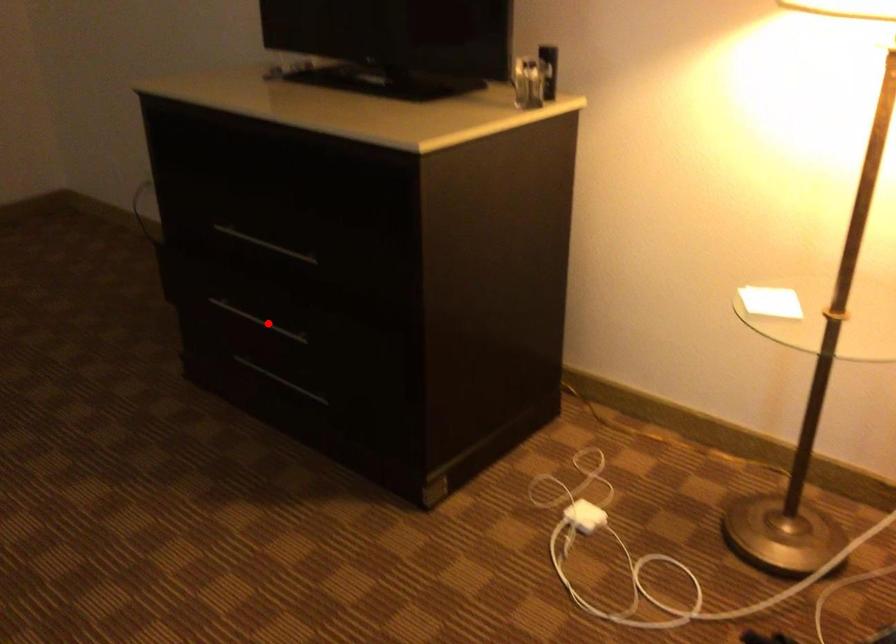
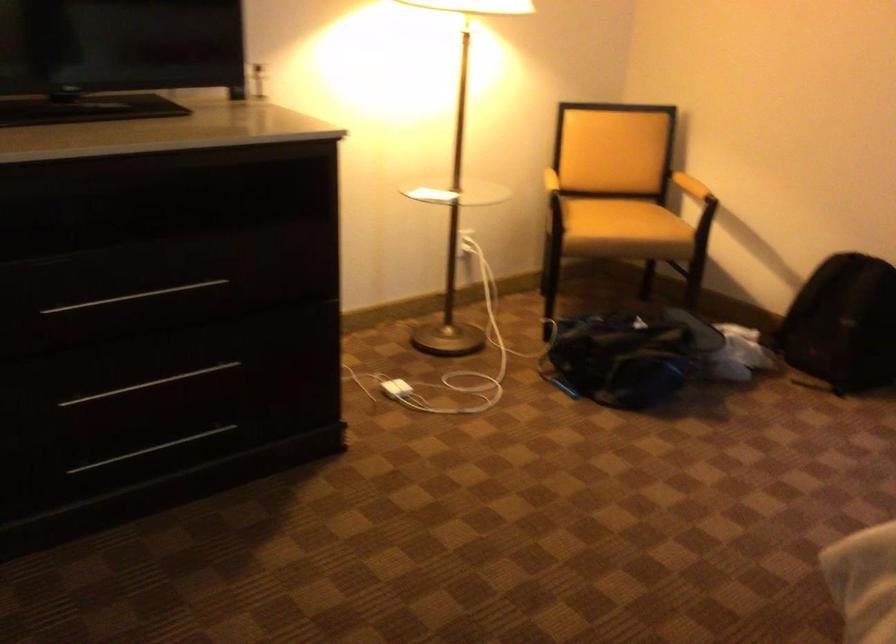
Locate, in the second image, the point that corresponds to the highlighted location in the first image.

(149, 384)